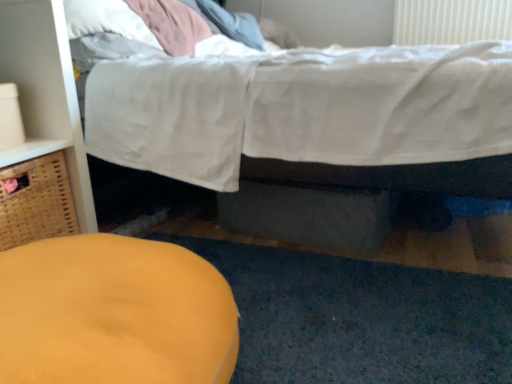
Question: Considering the relative sizes of matte wood dresser at left and matte yellow ottoman at lower left in the image provided, is matte wood dresser at left shorter than matte yellow ottoman at lower left?

Choices:
 (A) no
 (B) yes

Answer: (A)

Question: Considering the relative sizes of matte wood dresser at left and matte yellow ottoman at lower left in the image provided, is matte wood dresser at left taller than matte yellow ottoman at lower left?

Choices:
 (A) no
 (B) yes

Answer: (B)

Question: From a real-world perspective, is matte wood dresser at left located beneath matte yellow ottoman at lower left?

Choices:
 (A) yes
 (B) no

Answer: (B)

Question: Can you see matte wood dresser at left touching matte yellow ottoman at lower left?

Choices:
 (A) yes
 (B) no

Answer: (B)

Question: Is matte wood dresser at left to the right of matte yellow ottoman at lower left from the viewer's perspective?

Choices:
 (A) yes
 (B) no

Answer: (B)

Question: Based on their positions, is woven brown basket at left located to the left or right of white plastic radiator at upper right?

Choices:
 (A) right
 (B) left

Answer: (B)

Question: In terms of height, does woven brown basket at left look taller or shorter compared to white plastic radiator at upper right?

Choices:
 (A) short
 (B) tall

Answer: (B)

Question: From the image's perspective, is woven brown basket at left located above or below white plastic radiator at upper right?

Choices:
 (A) above
 (B) below

Answer: (B)

Question: In the image, is woven brown basket at left positioned in front of or behind white plastic radiator at upper right?

Choices:
 (A) front
 (B) behind

Answer: (A)

Question: From the image's perspective, is matte yellow ottoman at lower left positioned above or below white cotton bed at upper center?

Choices:
 (A) above
 (B) below

Answer: (B)

Question: Is matte yellow ottoman at lower left taller or shorter than white cotton bed at upper center?

Choices:
 (A) tall
 (B) short

Answer: (B)

Question: Is matte yellow ottoman at lower left to the left or to the right of white cotton bed at upper center in the image?

Choices:
 (A) left
 (B) right

Answer: (A)

Question: Considering their positions, is matte yellow ottoman at lower left located in front of or behind white cotton bed at upper center?

Choices:
 (A) behind
 (B) front

Answer: (B)

Question: From a real-world perspective, relative to matte yellow ottoman at lower left, is woven brown basket at left vertically above or below?

Choices:
 (A) below
 (B) above

Answer: (B)

Question: Would you say woven brown basket at left is inside or outside matte yellow ottoman at lower left?

Choices:
 (A) outside
 (B) inside

Answer: (A)